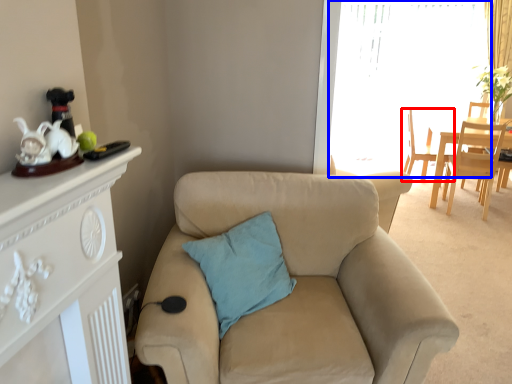
Question: Which object is closer to the camera taking this photo, chair (highlighted by a red box) or window screen (highlighted by a blue box)?

Choices:
 (A) chair
 (B) window screen

Answer: (A)